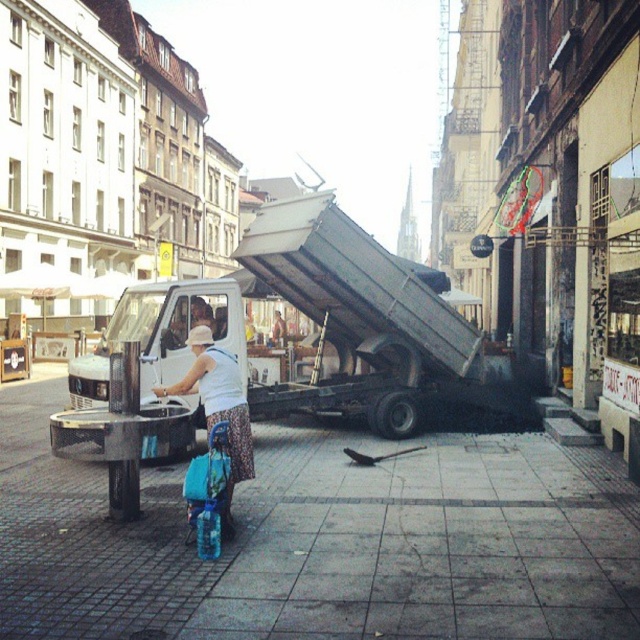
You are standing at the point marked by the coordinate point (326, 330) in the image. Which object are you closest to?

You are closest to the white matte truck at center, as the point (326, 330) represents its location.

You are a delivery person trying to maneuver a 2.5 meter wide delivery van through the space between the white matte truck at center and the white fabric dress at center. Can you safely pass through without hitting either object?

The distance between the white matte truck at center and the white fabric dress at center is 5.09 meters. Since the delivery van is 2.5 meters wide, there is sufficient space to pass safely as long as the van stays centered between them.

You are a delivery person trying to park your car between the white matte truck at center and another vehicle parked behind the white fabric dress at center. Can you fit your car there if your car is 1.8 meters wide?

The white matte truck at center might be wider than white fabric dress at center, so it is uncertain whether the space between them is wide enough for your 1.8 meter wide car. You should check the actual width before attempting to park.